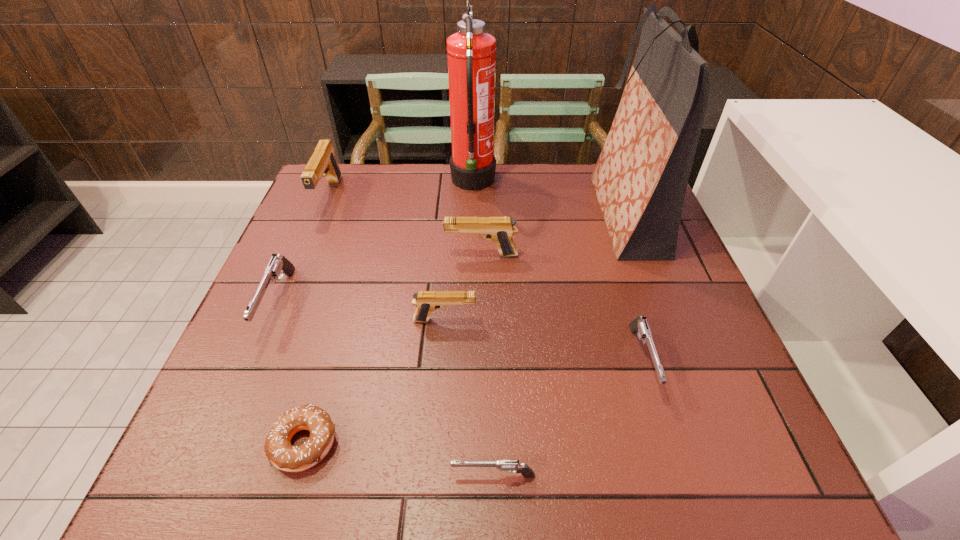
Find the location of a particular element. The image size is (960, 540). red fire extinguisher is located at coordinates point(471,52).

Identify the location of shopping bag. This screenshot has height=540, width=960. (640, 179).

Identify the location of the biggest tan pistol. (322, 163).

What are the coordinates of `the third tallest object` in the screenshot? It's located at (322, 163).

The width and height of the screenshot is (960, 540). What are the coordinates of `the fourth tallest object` in the screenshot? It's located at (500, 230).

Where is `the second smallest tan pistol`? This screenshot has height=540, width=960. the second smallest tan pistol is located at coordinates (500, 230).

You are a GUI agent. You are given a task and a screenshot of the screen. Output one action in this format:
    pyautogui.click(x=<x>, y=<y>)
    Task: Click on the biggest silver pistol
    The image size is (960, 540).
    Given the screenshot: What is the action you would take?
    pyautogui.click(x=278, y=265)

The image size is (960, 540). In order to click on the smallest tan pistol in this screenshot , I will do `click(426, 301)`.

This screenshot has width=960, height=540. I want to click on the rightmost pistol, so click(639, 325).

I want to click on the fifth tallest pistol, so click(639, 325).